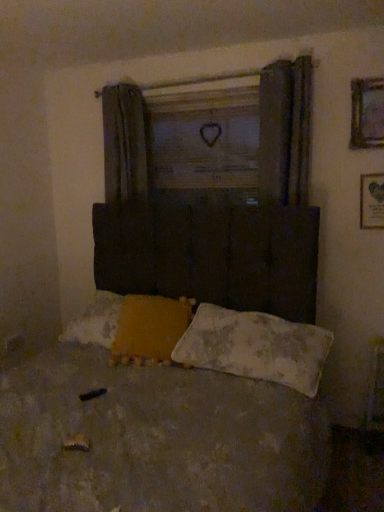
Question: From the image's perspective, is worn fabric bed at center beneath wooden framed picture at upper right, which is the first picture frame from top to bottom?

Choices:
 (A) no
 (B) yes

Answer: (B)

Question: Is worn fabric bed at center taller than wooden framed picture at upper right, which is the first picture frame from top to bottom?

Choices:
 (A) no
 (B) yes

Answer: (B)

Question: Considering the relative positions of worn fabric bed at center and wooden framed picture at upper right, the second picture frame ordered from the bottom, in the image provided, is worn fabric bed at center in front of wooden framed picture at upper right, the second picture frame ordered from the bottom,?

Choices:
 (A) yes
 (B) no

Answer: (A)

Question: Does worn fabric bed at center turn towards wooden framed picture at upper right, the second picture frame ordered from the bottom?

Choices:
 (A) no
 (B) yes

Answer: (A)

Question: Can you confirm if worn fabric bed at center is thinner than wooden framed picture at upper right, the second picture frame ordered from the bottom?

Choices:
 (A) yes
 (B) no

Answer: (B)

Question: Based on their sizes in the image, would you say white textured pillow at lower center, placed as the second pillow when sorted from left to right, is bigger or smaller than wooden framed picture at upper right, marked as the 1th picture frame in a bottom-to-top arrangement?

Choices:
 (A) big
 (B) small

Answer: (A)

Question: Do you think white textured pillow at lower center, placed as the second pillow when sorted from left to right, is within wooden framed picture at upper right, arranged as the 2th picture frame when viewed from the top, or outside of it?

Choices:
 (A) inside
 (B) outside

Answer: (B)

Question: From a real-world perspective, is white textured pillow at lower center, placed as the second pillow when sorted from left to right, positioned above or below wooden framed picture at upper right, marked as the 1th picture frame in a bottom-to-top arrangement?

Choices:
 (A) below
 (B) above

Answer: (A)

Question: Is point (172, 352) positioned closer to the camera than point (380, 226)?

Choices:
 (A) farther
 (B) closer

Answer: (B)

Question: Relative to wooden framed picture at upper right, marked as the 1th picture frame in a bottom-to-top arrangement, is wooden framed picture at upper right, which is the first picture frame from top to bottom, in front or behind?

Choices:
 (A) front
 (B) behind

Answer: (A)

Question: Visually, is wooden framed picture at upper right, the second picture frame ordered from the bottom, positioned to the left or to the right of wooden framed picture at upper right, arranged as the 2th picture frame when viewed from the top?

Choices:
 (A) left
 (B) right

Answer: (A)

Question: From the image's perspective, is wooden framed picture at upper right, which is the first picture frame from top to bottom, positioned above or below wooden framed picture at upper right, marked as the 1th picture frame in a bottom-to-top arrangement?

Choices:
 (A) below
 (B) above

Answer: (B)

Question: Considering the positions of wooden framed picture at upper right, the second picture frame ordered from the bottom, and wooden framed picture at upper right, arranged as the 2th picture frame when viewed from the top, in the image, is wooden framed picture at upper right, the second picture frame ordered from the bottom, taller or shorter than wooden framed picture at upper right, arranged as the 2th picture frame when viewed from the top,?

Choices:
 (A) short
 (B) tall

Answer: (B)

Question: Is worn fabric bed at center to the left or to the right of wooden framed picture at upper right, which is the first picture frame from top to bottom, in the image?

Choices:
 (A) right
 (B) left

Answer: (B)

Question: In terms of size, does worn fabric bed at center appear bigger or smaller than wooden framed picture at upper right, the second picture frame ordered from the bottom?

Choices:
 (A) small
 (B) big

Answer: (B)